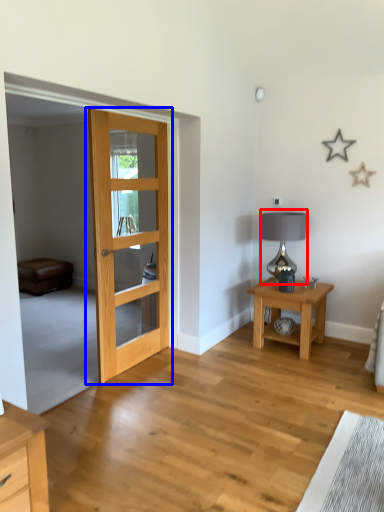
Question: Among these objects, which one is farthest to the camera, table lamp (highlighted by a red box) or door (highlighted by a blue box)?

Choices:
 (A) table lamp
 (B) door

Answer: (A)